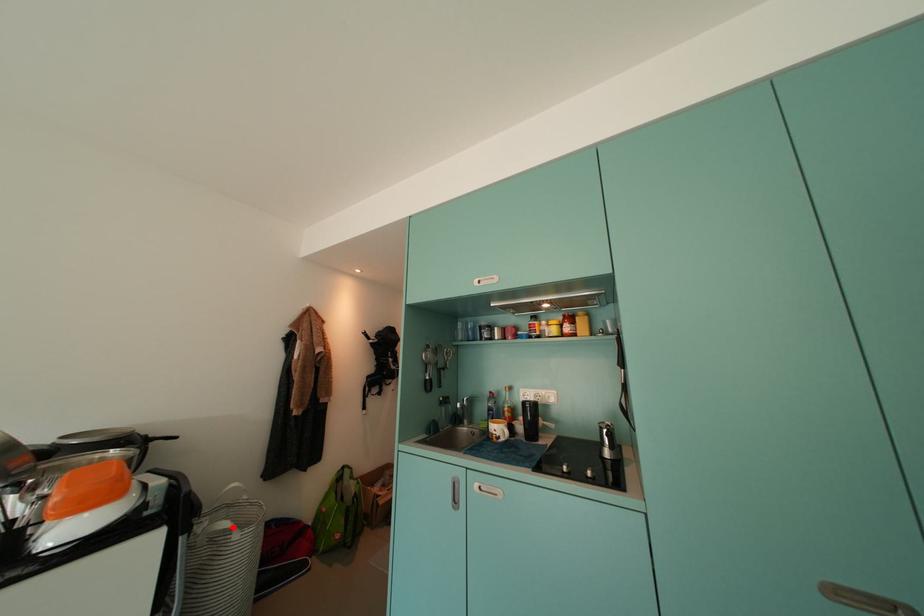
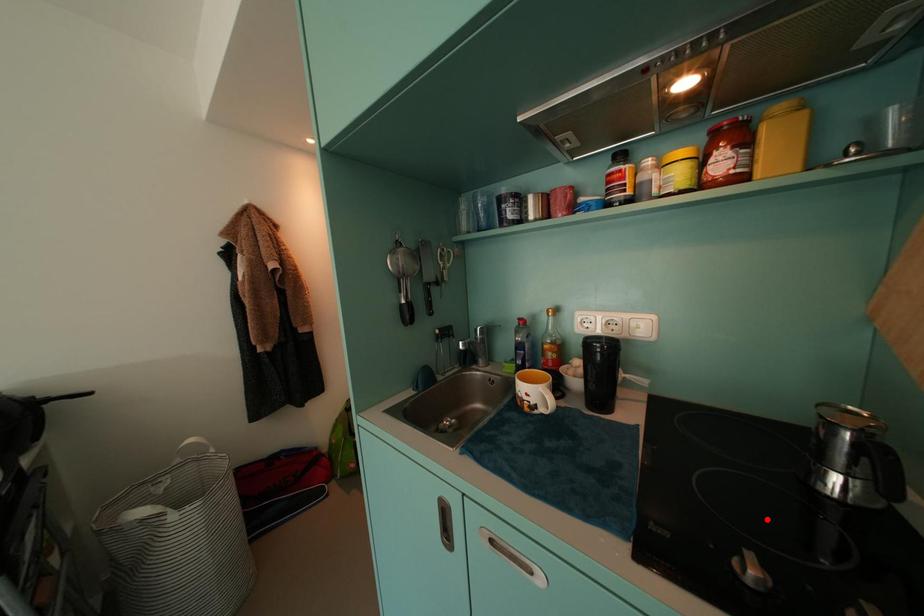
I am providing you with two images of the same scene from different viewpoints. A red point is marked on the first image and another point is marked on the second image. Is the marked point in image1 the same physical position as the marked point in image2?

No